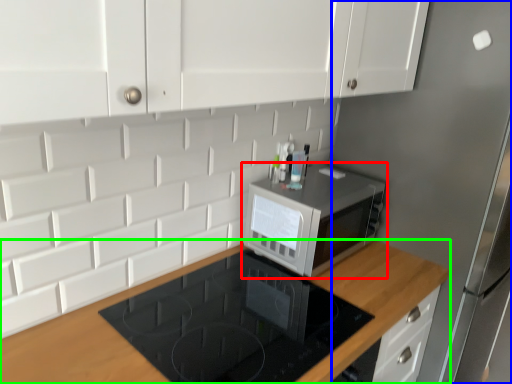
Question: Which object is the closest to the microwave oven (highlighted by a red box)? Choose among these: fridge (highlighted by a blue box) or countertop (highlighted by a green box).

Choices:
 (A) fridge
 (B) countertop

Answer: (B)